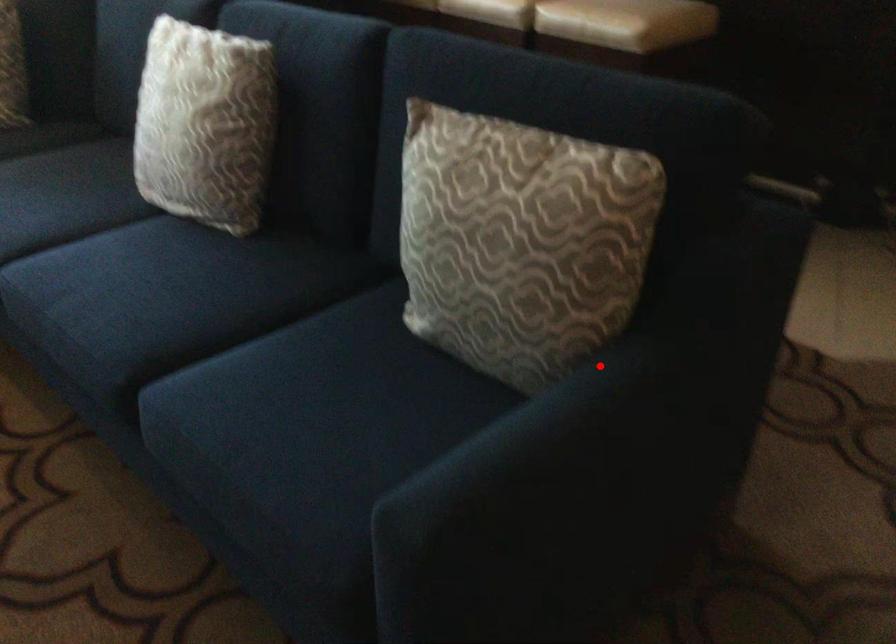
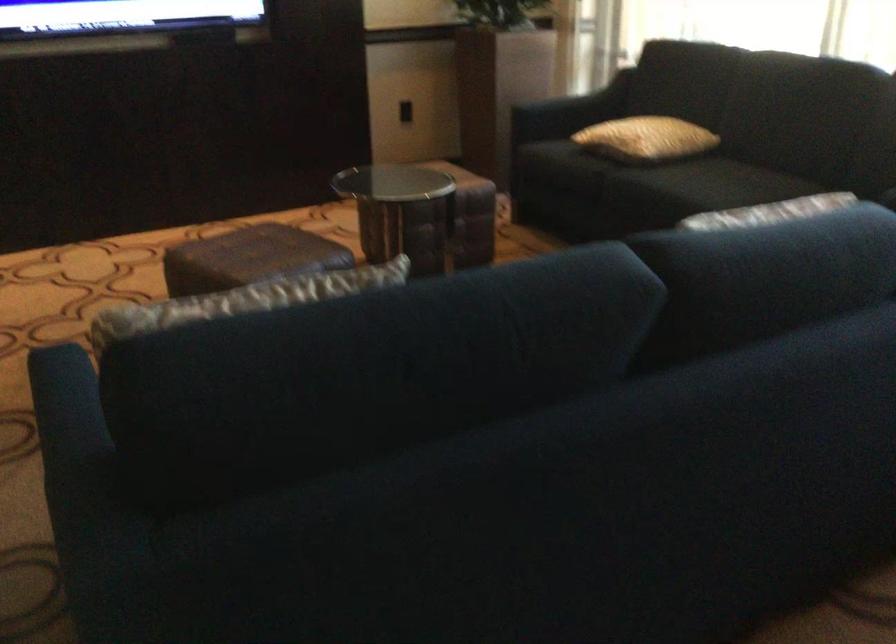
The point at the highlighted location is marked in the first image. Where is the corresponding point in the second image?

(69, 431)